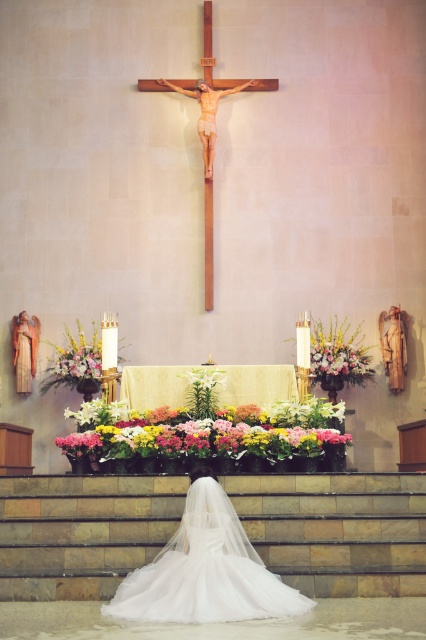
Does white tulle dress at lower center appear on the right side of vibrant floral bouquet at center?

No, white tulle dress at lower center is not to the right of vibrant floral bouquet at center.

Describe the element at coordinates (206, 570) in the screenshot. The width and height of the screenshot is (426, 640). I see `white tulle dress at lower center` at that location.

Does point (198, 504) come in front of point (275, 429)?

Yes.

I want to click on white tulle dress at lower center, so click(206, 570).

Who is taller, vibrant floral bouquet at center or matte gold statue at upper center?

matte gold statue at upper center is taller.

Which of these two, vibrant floral bouquet at center or matte gold statue at upper center, stands shorter?

vibrant floral bouquet at center

What do you see at coordinates (207, 432) in the screenshot? This screenshot has height=640, width=426. I see `vibrant floral bouquet at center` at bounding box center [207, 432].

Image resolution: width=426 pixels, height=640 pixels. I want to click on vibrant floral bouquet at center, so click(207, 432).

Is point (271, 576) closer to viewer compared to point (163, 77)?

That is True.

Is point (207, 468) farther from camera compared to point (201, 125)?

No, it is in front of (201, 125).

Identify the location of white tulle dress at lower center. (206, 570).